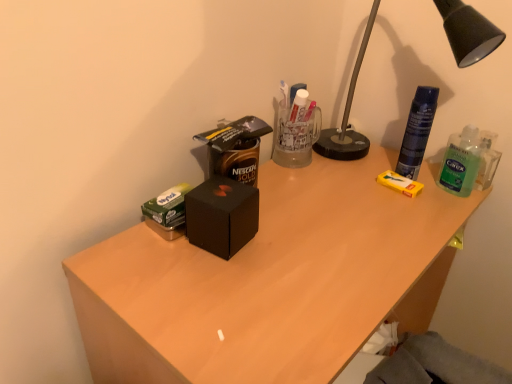
Locate an element on the screen. This screenshot has width=512, height=384. free space to the left of black metal lamp at upper right is located at coordinates tap(310, 181).